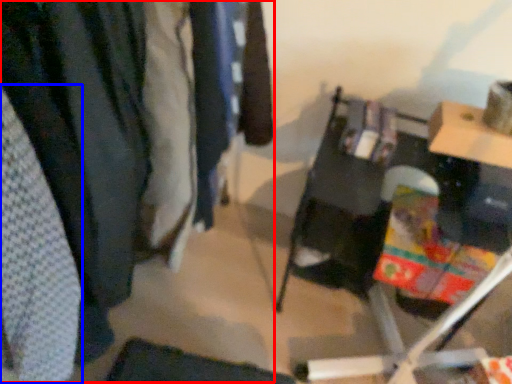
Question: Which of the following is the farthest to the observer, closet (highlighted by a red box) or clothing (highlighted by a blue box)?

Choices:
 (A) closet
 (B) clothing

Answer: (A)